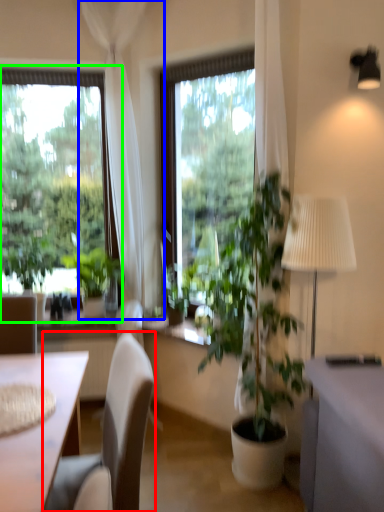
Question: Considering the real-world distances, which object is farthest from chair (highlighted by a red box)? curtain (highlighted by a blue box) or window (highlighted by a green box)?

Choices:
 (A) curtain
 (B) window

Answer: (B)